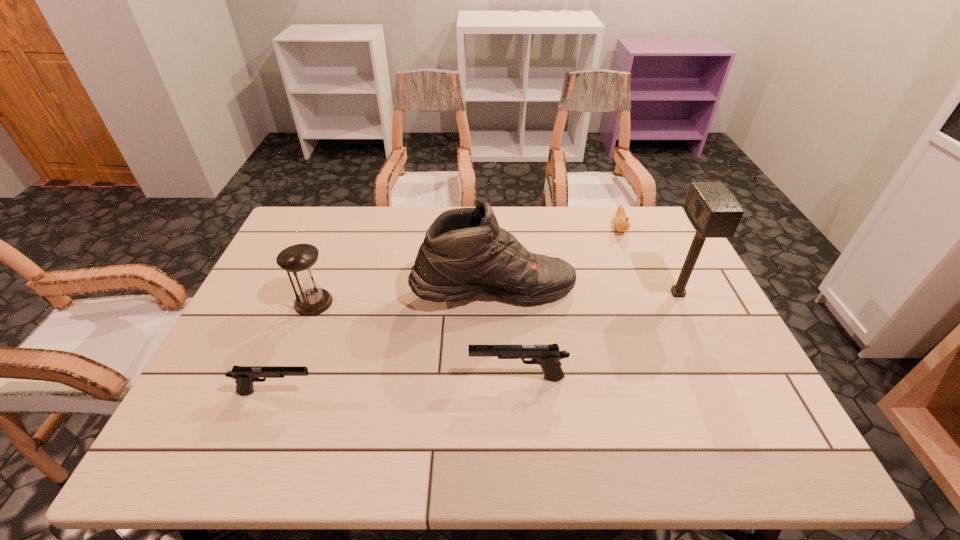
In order to click on vacant region at the near right corner in this screenshot , I will do `click(718, 393)`.

Find the location of a particular element. This screenshot has height=540, width=960. free spot between the mallet and the ski boot is located at coordinates (586, 292).

Find the location of `free space that is in between the second object from right to left and the rightmost object`. free space that is in between the second object from right to left and the rightmost object is located at coordinates (649, 261).

Where is `free space between the right gun and the shortest object`? free space between the right gun and the shortest object is located at coordinates pos(568,302).

Identify the location of vacant point located between the farthest object and the third shortest object. This screenshot has height=540, width=960. (568, 302).

You are a GUI agent. You are given a task and a screenshot of the screen. Output one action in this format:
    pyautogui.click(x=<x>, y=<y>)
    Task: Click on the vacant point located between the rightmost object and the ski boot
    This screenshot has width=960, height=540.
    Given the screenshot: What is the action you would take?
    pyautogui.click(x=586, y=292)

The width and height of the screenshot is (960, 540). I want to click on vacant point located between the hourglass and the third shortest object, so click(x=416, y=340).

You are a GUI agent. You are given a task and a screenshot of the screen. Output one action in this format:
    pyautogui.click(x=<x>, y=<y>)
    Task: Click on the free space between the shortest object and the nearer gun
    The height and width of the screenshot is (540, 960).
    Given the screenshot: What is the action you would take?
    pyautogui.click(x=448, y=310)

Find the location of `free space between the shortest object and the right gun`. free space between the shortest object and the right gun is located at coordinates (568, 302).

Identify the location of object that is the second closest to the ski boot. (311, 300).